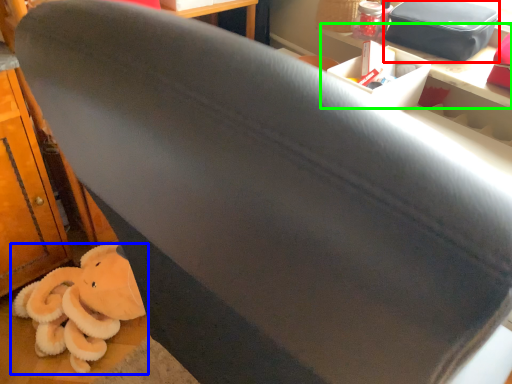
Question: Estimate the real-world distances between objects in this image. Which object is closer to kit (highlighted by a red box), toy (highlighted by a blue box) or table (highlighted by a green box)?

Choices:
 (A) toy
 (B) table

Answer: (B)